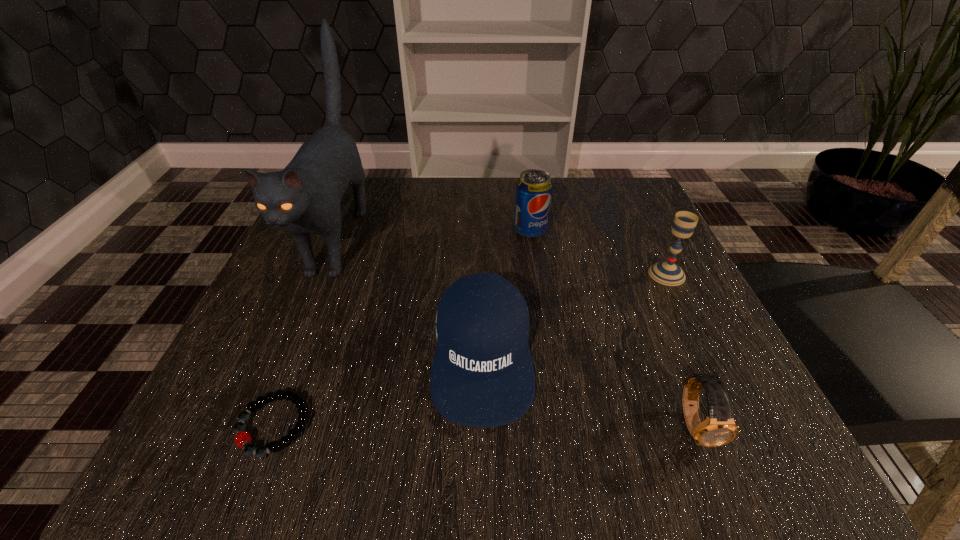
The width and height of the screenshot is (960, 540). What are the coordinates of `free spot that satisfies the following two spatial constraints: 1. on the back side of the soda; 2. on the left side of the bracelet` in the screenshot? It's located at (349, 231).

Locate an element on the screen. free spot that satisfies the following two spatial constraints: 1. on the back side of the soda; 2. on the left side of the bracelet is located at coordinates (349, 231).